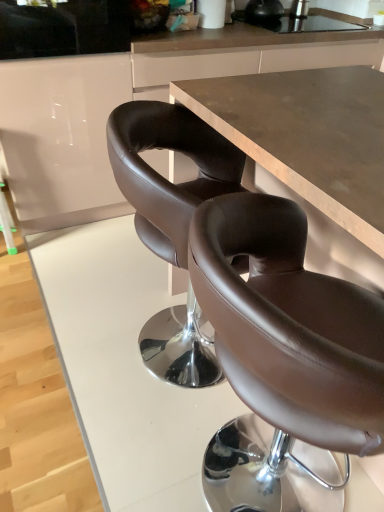
Question: From a real-world perspective, is brown leather bar stool at left located beneath brown leather chair at center?

Choices:
 (A) yes
 (B) no

Answer: (A)

Question: Does brown leather bar stool at left have a greater height compared to brown leather chair at center?

Choices:
 (A) yes
 (B) no

Answer: (B)

Question: Is brown leather bar stool at left turned away from brown leather chair at center?

Choices:
 (A) yes
 (B) no

Answer: (B)

Question: Does brown leather bar stool at left appear on the left side of brown leather chair at center?

Choices:
 (A) yes
 (B) no

Answer: (A)

Question: Is brown leather bar stool at left positioned behind brown leather chair at center?

Choices:
 (A) yes
 (B) no

Answer: (A)

Question: Considering the positions of brown leather bar stool at left and brown leather chair at center in the image, is brown leather bar stool at left wider or thinner than brown leather chair at center?

Choices:
 (A) wide
 (B) thin

Answer: (A)

Question: Relative to brown leather chair at center, is brown leather bar stool at left in front or behind?

Choices:
 (A) front
 (B) behind

Answer: (B)

Question: Choose the correct answer: Is brown leather bar stool at left inside brown leather chair at center or outside it?

Choices:
 (A) inside
 (B) outside

Answer: (B)

Question: Considering the positions of brown leather bar stool at left and brown leather chair at center in the image, is brown leather bar stool at left taller or shorter than brown leather chair at center?

Choices:
 (A) short
 (B) tall

Answer: (A)

Question: Considering the positions of white glossy cabinet at upper left and brown leather bar stool at left in the image, is white glossy cabinet at upper left taller or shorter than brown leather bar stool at left?

Choices:
 (A) short
 (B) tall

Answer: (B)

Question: Choose the correct answer: Is white glossy cabinet at upper left inside brown leather bar stool at left or outside it?

Choices:
 (A) outside
 (B) inside

Answer: (A)

Question: Based on their sizes in the image, would you say white glossy cabinet at upper left is bigger or smaller than brown leather bar stool at left?

Choices:
 (A) big
 (B) small

Answer: (A)

Question: From the image's perspective, is white glossy cabinet at upper left positioned above or below brown leather bar stool at left?

Choices:
 (A) above
 (B) below

Answer: (A)

Question: From a real-world perspective, is brown matte counter at center positioned above or below white glossy cabinet at upper left?

Choices:
 (A) above
 (B) below

Answer: (B)

Question: Would you say brown matte counter at center is to the left or to the right of white glossy cabinet at upper left in the picture?

Choices:
 (A) right
 (B) left

Answer: (A)